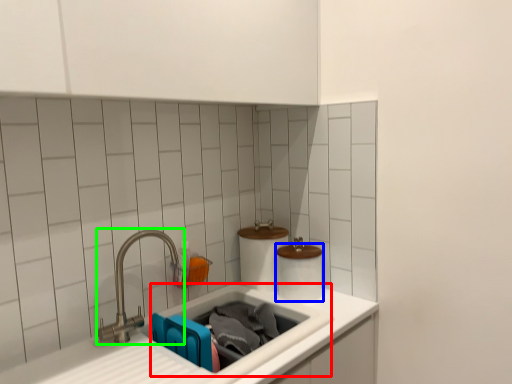
Question: Which object is positioned farthest from sink (highlighted by a red box)? Select from toilet paper (highlighted by a blue box) and tap (highlighted by a green box).

Choices:
 (A) toilet paper
 (B) tap

Answer: (B)